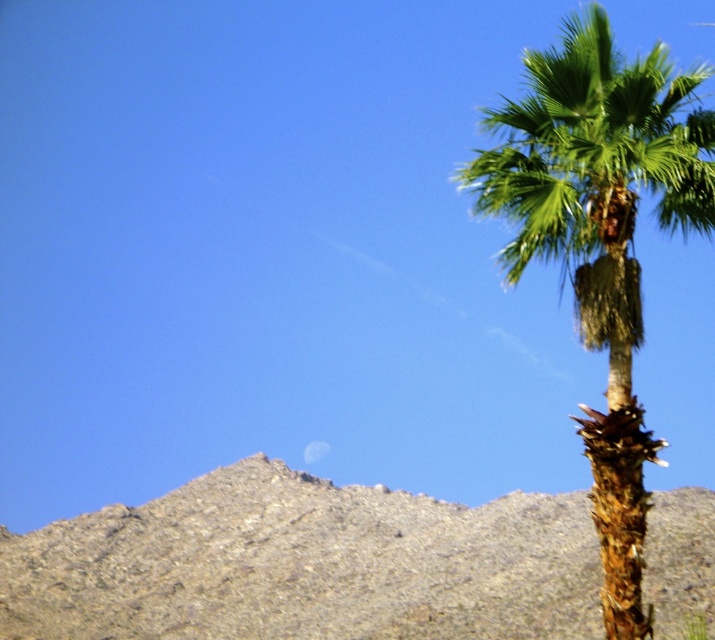
Question: Is gray rocky mountain at center bigger than green leafy palm at right?

Choices:
 (A) no
 (B) yes

Answer: (B)

Question: Which point is farther from the camera taking this photo?

Choices:
 (A) (603, 524)
 (B) (220, 476)

Answer: (B)

Question: Can you confirm if gray rocky mountain at center is thinner than green leafy palm at right?

Choices:
 (A) yes
 (B) no

Answer: (B)

Question: Can you confirm if gray rocky mountain at center is thinner than green leafy palm at right?

Choices:
 (A) no
 (B) yes

Answer: (A)